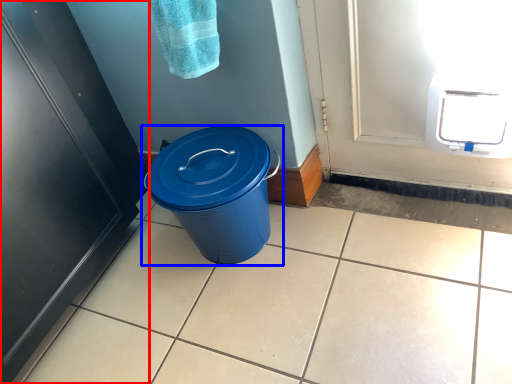
Question: Which point is closer to the camera, door (highlighted by a red box) or waste container (highlighted by a blue box)?

Choices:
 (A) door
 (B) waste container

Answer: (A)